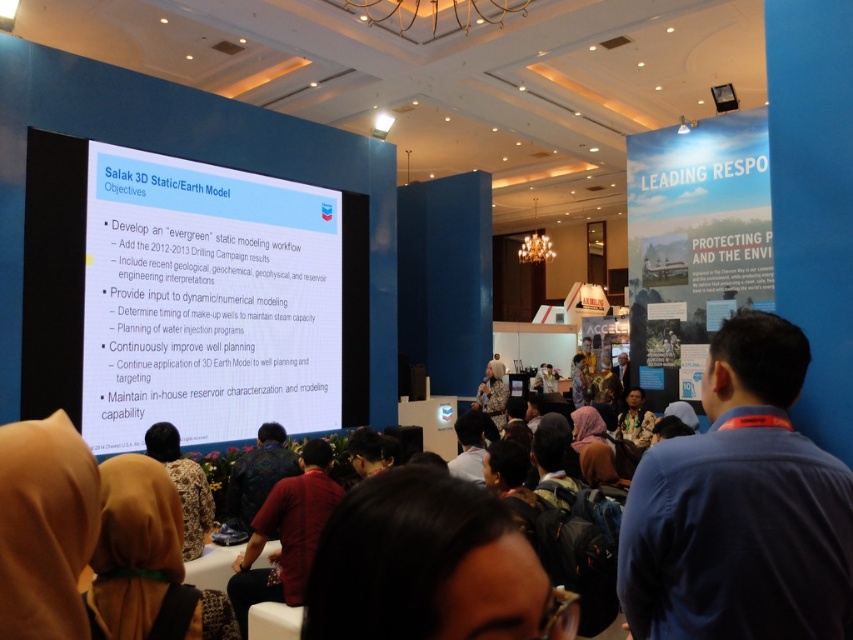
Question: Which of these objects is positioned farthest from the patterned fabric headscarf at lower left?

Choices:
 (A) white glossy projection screen at upper center
 (B) dark brown leather jacket at center

Answer: (A)

Question: Does dark brown hair at center have a lesser width compared to dark brown leather jacket at center?

Choices:
 (A) no
 (B) yes

Answer: (B)

Question: Which point is farther from the camera taking this photo?

Choices:
 (A) (442, 612)
 (B) (158, 433)
 (C) (636, 536)

Answer: (B)

Question: Is blue shirt at center positioned at the back of patterned fabric headscarf at lower left?

Choices:
 (A) no
 (B) yes

Answer: (A)

Question: Can you confirm if white glossy projection screen at upper center is smaller than patterned fabric headscarf at lower left?

Choices:
 (A) no
 (B) yes

Answer: (A)

Question: Which object appears closest to the camera in this image?

Choices:
 (A) red cotton shirt at center
 (B) patterned fabric headscarf at lower left

Answer: (A)